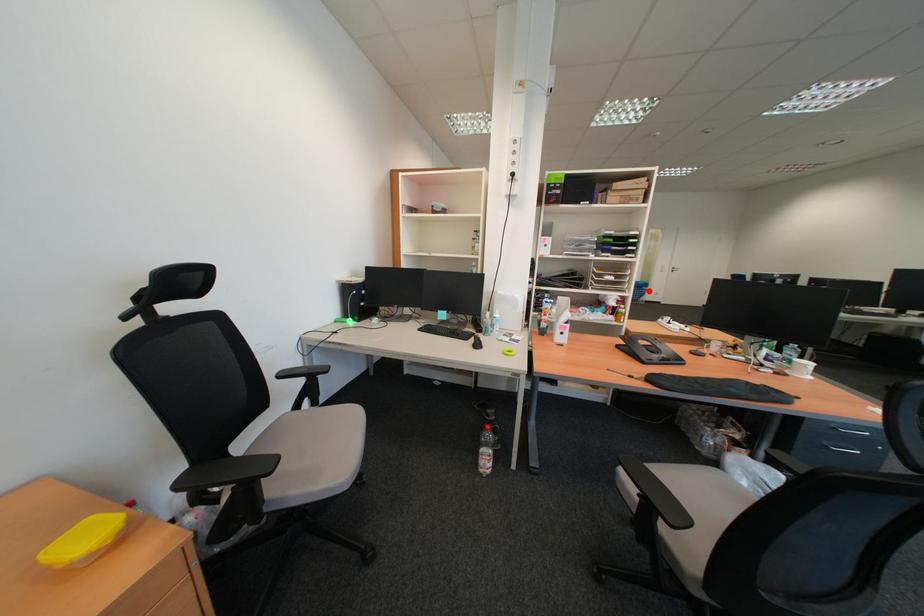
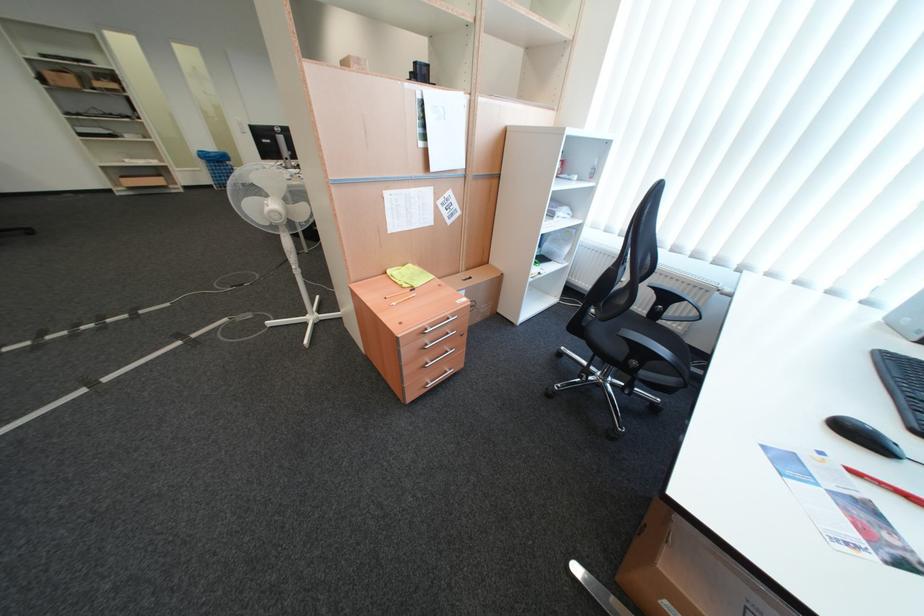
Locate, in the second image, the point that corresponds to the highlighted location in the first image.

(227, 168)